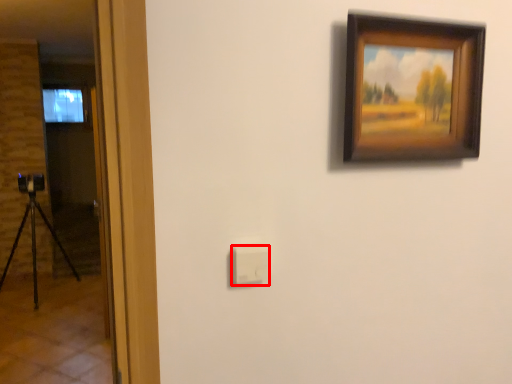
Question: Observing the image, what is the correct spatial positioning of light switch (annotated by the red box) in reference to picture frame?

Choices:
 (A) left
 (B) right

Answer: (A)